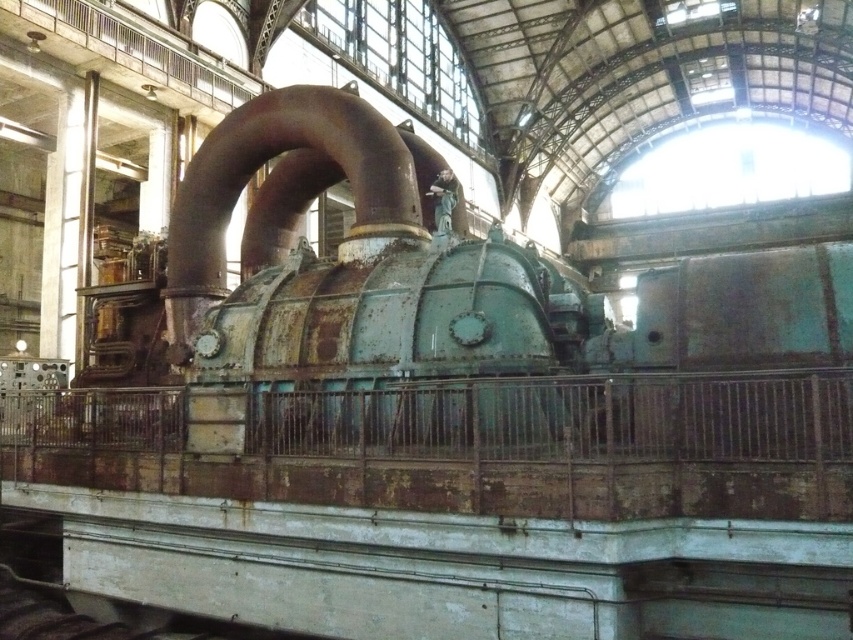
You are an engineer inspecting the industrial hall. You need to determine if the rusty metal pipe at center can be moved to the left side without touching the rusty metal steam engine at center. The pipe is 2 meters wide. What should you consider?

The rusty metal steam engine at center is wider than the rusty metal pipe at center. Since the pipe is 2 meters wide, you need to ensure there is enough space between the engine and the left side to move the pipe without collision.

You are an engineer inspecting the industrial hall. You need to determine which object requires more maintenance based on their sizes. Which object should you prioritize? The rusty metal steam engine at center or the rusty metal pipe at center?

The rusty metal steam engine at center is bigger than the rusty metal pipe at center, so you should prioritize maintaining the rusty metal steam engine at center since larger machinery typically requires more maintenance.